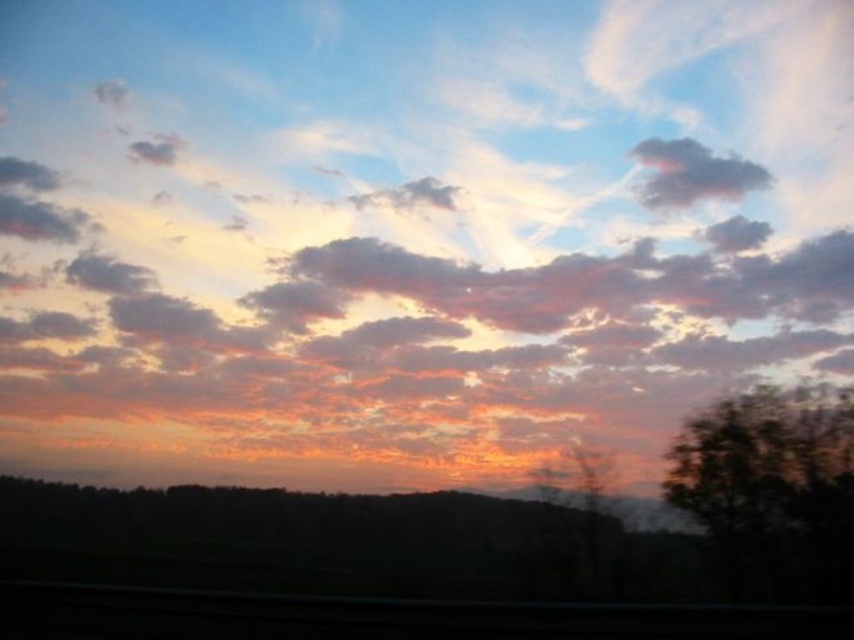
Does dark green leafy tree at right have a greater width compared to dark gray fluffy cloud at upper center?

Incorrect, dark green leafy tree at right's width does not surpass dark gray fluffy cloud at upper center's.

Is dark green leafy tree at right further to camera compared to dark gray fluffy cloud at upper center?

No, dark green leafy tree at right is closer to the viewer.

Who is more forward, [747,408] or [646,147]?

Positioned in front is point [747,408].

The width and height of the screenshot is (854, 640). Find the location of `dark green leafy tree at right`. dark green leafy tree at right is located at coordinates (771, 490).